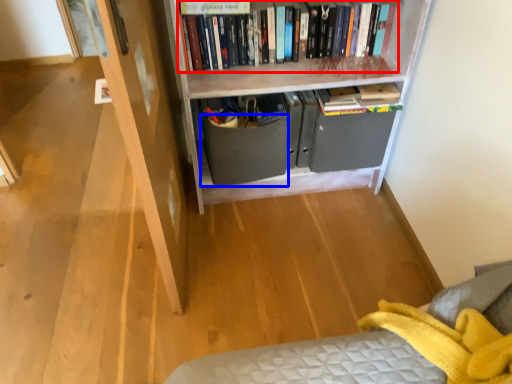
Question: Among these objects, which one is nearest to the camera, book (highlighted by a red box) or drawer (highlighted by a blue box)?

Choices:
 (A) book
 (B) drawer

Answer: (A)